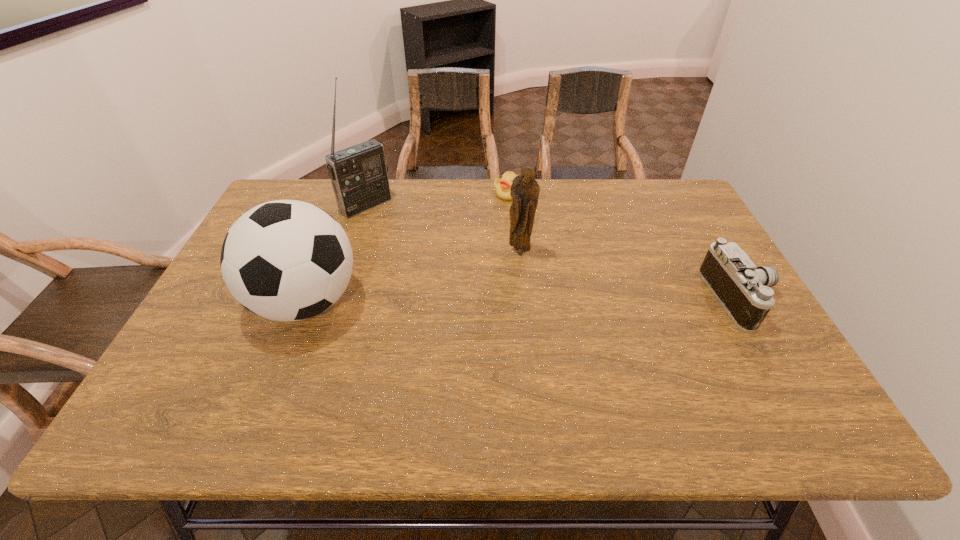
This screenshot has height=540, width=960. I want to click on free space on the desktop that is between the soccer ball and the camera and is positioned on the front-facing side of the figurine, so coord(467,301).

The height and width of the screenshot is (540, 960). What are the coordinates of `vacant space on the desktop that is between the soccer ball and the second shortest object and is positioned at the face of the duckling` in the screenshot? It's located at (461, 301).

Where is `free space on the desktop that is between the soccer ball and the fourth tallest object and is positioned on the display of the tallest object`? This screenshot has width=960, height=540. free space on the desktop that is between the soccer ball and the fourth tallest object and is positioned on the display of the tallest object is located at coordinates (479, 301).